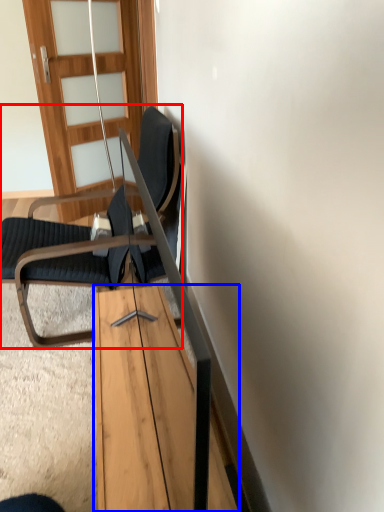
Question: Among these objects, which one is nearest to the camera, chair (highlighted by a red box) or table (highlighted by a blue box)?

Choices:
 (A) chair
 (B) table

Answer: (B)